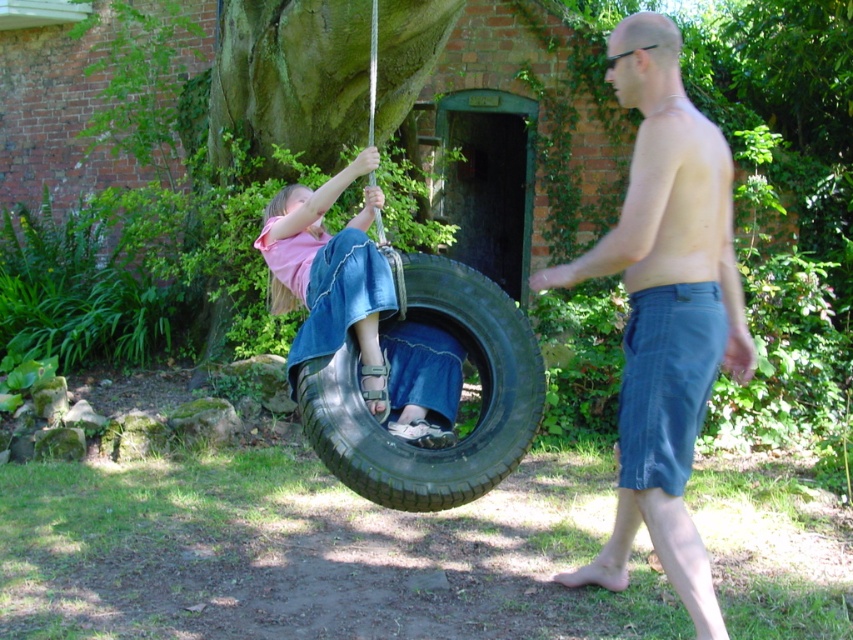
You are a fashion designer observing the outdoor scene. You notice two denim items in the image. Which of the two items, the blue denim shorts at right or the denim skirt at center, has a narrower width?

The blue denim shorts at right is thinner than the denim skirt at center, so the blue denim shorts at right has a narrower width.

You are a clothing designer observing the outdoor scene. You need to determine which clothing item is more suitable for a child who needs to move freely while swinging. Based on the sizes of blue denim shorts at right and denim skirt at center, which one would you recommend?

The blue denim shorts at right is larger in size than the denim skirt at center, so the blue denim shorts at right would be more suitable for a child needing to move freely while swinging as they provide more mobility compared to the skirt.

You are a photographer trying to capture a photo of the black rubber tire at center and the denim skirt at center. Since you want both subjects to be in the frame, which direction should you move your camera to ensure both are visible?

The black rubber tire at center is to the right of denim skirt at center, so you should move your camera slightly to the left to ensure both are visible in the frame.